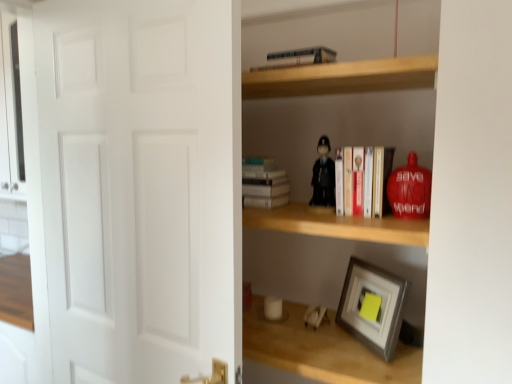
What do you see at coordinates (362, 181) in the screenshot?
I see `hardcover books at center, positioned as the first book in right-to-left order` at bounding box center [362, 181].

Image resolution: width=512 pixels, height=384 pixels. Find the location of `white matte door at left`. white matte door at left is located at coordinates (141, 186).

You are a GUI agent. You are given a task and a screenshot of the screen. Output one action in this format:
    pyautogui.click(x=<x>, y=<y>)
    Task: Click on the wooden shelf at lower right, positioned as the 1th shelf in bottom-to-top order
    The image size is (512, 384).
    Given the screenshot: What is the action you would take?
    pyautogui.click(x=325, y=267)

Identify the location of the 3rd toy directly beneath the wooden shelf at upper center (from a real-world perspective). (315, 316).

Can you confirm if white plastic toy at lower center, the first toy when ordered from back to front, is wider than wooden shelf at upper center?

No, white plastic toy at lower center, the first toy when ordered from back to front, is not wider than wooden shelf at upper center.

Considering the positions of objects white plastic toy at lower center, arranged as the 3th toy when viewed from the top, and wooden shelf at upper center in the image provided, who is more to the right, white plastic toy at lower center, arranged as the 3th toy when viewed from the top, or wooden shelf at upper center?

Positioned to the right is white plastic toy at lower center, arranged as the 3th toy when viewed from the top.

From a real-world perspective, is white plastic toy at lower center, arranged as the 3th toy when viewed from the top, above or below wooden shelf at upper center?

white plastic toy at lower center, arranged as the 3th toy when viewed from the top, is situated lower than wooden shelf at upper center in the real world.

Can we say metallic silver train at upper center, acting as the 2th book starting from the right, lies outside hardcover books at center, the second book in the left-to-right sequence?

Yes, metallic silver train at upper center, acting as the 2th book starting from the right, is located beyond the bounds of hardcover books at center, the second book in the left-to-right sequence.

Could you tell me if metallic silver train at upper center, the first book when ordered from left to right, is turned towards hardcover books at center, arranged as the first book when ordered from the bottom?

No, metallic silver train at upper center, the first book when ordered from left to right, is not aimed at hardcover books at center, arranged as the first book when ordered from the bottom.

From their relative heights in the image, would you say metallic silver train at upper center, the 1th book positioned from the top, is taller or shorter than hardcover books at center, the second book in the left-to-right sequence?

Considering their sizes, metallic silver train at upper center, the 1th book positioned from the top, has less height than hardcover books at center, the second book in the left-to-right sequence.

Does point (254, 68) appear closer or farther from the camera than point (356, 201)?

Point (254, 68) is positioned farther from the camera compared to point (356, 201).

Is matte black figurine at center, which is the 2th toy in left-to-right order, taller than wooden shelf at upper center?

Yes, matte black figurine at center, which is the 2th toy in left-to-right order, is taller than wooden shelf at upper center.

Can you confirm if matte black figurine at center, marked as the 2th toy in a front-to-back arrangement, is bigger than wooden shelf at upper center?

Actually, matte black figurine at center, marked as the 2th toy in a front-to-back arrangement, might be smaller than wooden shelf at upper center.

Would you say wooden shelf at upper center is part of matte black figurine at center, which appears as the 3th toy when ordered from the bottom,'s contents?

Actually, wooden shelf at upper center is outside matte black figurine at center, which appears as the 3th toy when ordered from the bottom.

How distant is metallic silver train at upper center, marked as the second book in a bottom-to-top arrangement, from wooden shelf at lower right, positioned as the 1th shelf in bottom-to-top order?

metallic silver train at upper center, marked as the second book in a bottom-to-top arrangement, is 30.89 inches away from wooden shelf at lower right, positioned as the 1th shelf in bottom-to-top order.

From a real-world perspective, is metallic silver train at upper center, marked as the second book in a bottom-to-top arrangement, over wooden shelf at lower right, positioned as the 1th shelf in bottom-to-top order?

Yes, from a real-world perspective, metallic silver train at upper center, marked as the second book in a bottom-to-top arrangement, is on top of wooden shelf at lower right, positioned as the 1th shelf in bottom-to-top order.

Between metallic silver train at upper center, marked as the second book in a bottom-to-top arrangement, and wooden shelf at lower right, the second shelf from the top, which one has less height?

Standing shorter between the two is wooden shelf at lower right, the second shelf from the top.

Based on the photo, is metallic silver train at upper center, the first book when ordered from left to right, not inside wooden shelf at lower right, positioned as the 1th shelf in bottom-to-top order?

metallic silver train at upper center, the first book when ordered from left to right, is positioned outside wooden shelf at lower right, positioned as the 1th shelf in bottom-to-top order.

Which is in front, matte red vase at upper right, the 3th toy in the left-to-right sequence, or wooden shelf at upper center?

→ Positioned in front is wooden shelf at upper center.

Could you tell me if matte red vase at upper right, positioned as the second toy in bottom-to-top order, is facing wooden shelf at upper center?

No, matte red vase at upper right, positioned as the second toy in bottom-to-top order, is not turned towards wooden shelf at upper center.

Which object is positioned more to the right, matte red vase at upper right, the 3th toy in the left-to-right sequence, or wooden shelf at upper center?

Positioned to the right is matte red vase at upper right, the 3th toy in the left-to-right sequence.

Is the surface of matte red vase at upper right, which is counted as the first toy, starting from the right, in direct contact with wooden shelf at upper center?

matte red vase at upper right, which is counted as the first toy, starting from the right, and wooden shelf at upper center are not in contact.

Considering the relative sizes of wooden shelf at center, the second shelf when ordered from bottom to top, and matte red vase at upper right, which is counted as the first toy, starting from the right, in the image provided, is wooden shelf at center, the second shelf when ordered from bottom to top, shorter than matte red vase at upper right, which is counted as the first toy, starting from the right,?

Incorrect, the height of wooden shelf at center, the second shelf when ordered from bottom to top, does not fall short of that of matte red vase at upper right, which is counted as the first toy, starting from the right.

Between wooden shelf at center, the second shelf when ordered from bottom to top, and matte red vase at upper right, the 3th toy in the left-to-right sequence, which one has smaller width?

matte red vase at upper right, the 3th toy in the left-to-right sequence.

Is wooden shelf at center, the first shelf when ordered from top to bottom, positioned before matte red vase at upper right, arranged as the 2th toy when viewed from the top?

Yes, wooden shelf at center, the first shelf when ordered from top to bottom, is closer to the viewer.

Which is more to the right, wooden shelf at center, the first shelf when ordered from top to bottom, or matte red vase at upper right, placed as the 3th toy when sorted from back to front?

Positioned to the right is matte red vase at upper right, placed as the 3th toy when sorted from back to front.

Is white plastic toy at lower center, acting as the third toy starting from the front, turned away from matte red vase at upper right, the 3th toy in the left-to-right sequence?

No, white plastic toy at lower center, acting as the third toy starting from the front, is not facing the opposite direction of matte red vase at upper right, the 3th toy in the left-to-right sequence.

Is the depth of white plastic toy at lower center, acting as the third toy starting from the front, less than that of matte red vase at upper right, positioned as the second toy in bottom-to-top order?

No, it is behind matte red vase at upper right, positioned as the second toy in bottom-to-top order.

From the image's perspective, is white plastic toy at lower center, the first toy positioned from the bottom, on matte red vase at upper right, positioned as the second toy in bottom-to-top order?

No, from the image's perspective, white plastic toy at lower center, the first toy positioned from the bottom, is not over matte red vase at upper right, positioned as the second toy in bottom-to-top order.

Is white plastic toy at lower center, arranged as the 3th toy when viewed from the right, next to matte red vase at upper right, the 3th toy in the left-to-right sequence?

They are not placed beside each other.

The image size is (512, 384). Identify the location of the 3rd toy behind the wooden shelf at upper center, starting your count from the anchor. (315, 316).

Locate an element on the screen. This screenshot has width=512, height=384. book located on the left of hardcover books at center, arranged as the first book when ordered from the bottom is located at coordinates (298, 58).

Considering their positions, is white matte door at left positioned further to matte black figurine at center, which appears as the 3th toy when ordered from the bottom, than wooden shelf at center, the first shelf when ordered from top to bottom?

white matte door at left lies further to matte black figurine at center, which appears as the 3th toy when ordered from the bottom, than the other object.

From the picture: Estimate the real-world distances between objects in this image. Which object is further from wooden shelf at lower right, positioned as the 1th shelf in bottom-to-top order, white matte door at left or metallic silver train at upper center, the 1th book positioned from the top?

The object further to wooden shelf at lower right, positioned as the 1th shelf in bottom-to-top order, is metallic silver train at upper center, the 1th book positioned from the top.

Based on their spatial positions, is metallic silver train at upper center, acting as the 2th book starting from the right, or wooden shelf at lower right, positioned as the 1th shelf in bottom-to-top order, closer to hardcover books at center, the second book in the left-to-right sequence?

Among the two, metallic silver train at upper center, acting as the 2th book starting from the right, is located nearer to hardcover books at center, the second book in the left-to-right sequence.

Estimate the real-world distances between objects in this image. Which object is closer to white matte stack of books at upper center, white matte door at left or matte black figurine at center, placed as the second toy when sorted from back to front?

Among the two, matte black figurine at center, placed as the second toy when sorted from back to front, is located nearer to white matte stack of books at upper center.

Based on the photo, when comparing their distances from metallic silver train at upper center, the 1th book positioned from the top, does hardcover books at center, positioned as the first book in right-to-left order, or white matte door at left seem further?

white matte door at left.

When comparing their distances from metallic silver train at upper center, the 1th book positioned from the top, does white plastic toy at lower center, acting as the third toy starting from the front, or matte black figurine at center, which is the 2th toy in left-to-right order, seem closer?

matte black figurine at center, which is the 2th toy in left-to-right order, is closer to metallic silver train at upper center, the 1th book positioned from the top.

Which object lies further to the anchor point white matte door at left, wooden shelf at center, the second shelf when ordered from bottom to top, or white matte stack of books at upper center?

The object further to white matte door at left is wooden shelf at center, the second shelf when ordered from bottom to top.

Based on their spatial positions, is white matte stack of books at upper center or matte black figurine at center, marked as the 2th toy in a front-to-back arrangement, closer to wooden shelf at center, the second shelf when ordered from bottom to top?

Based on the image, white matte stack of books at upper center appears to be nearer to wooden shelf at center, the second shelf when ordered from bottom to top.

Where is `cabinet located between white matte stack of books at upper center and matte red vase at upper right, placed as the 3th toy when sorted from back to front, in the left-right direction`? This screenshot has width=512, height=384. cabinet located between white matte stack of books at upper center and matte red vase at upper right, placed as the 3th toy when sorted from back to front, in the left-right direction is located at coordinates (342, 77).

The height and width of the screenshot is (384, 512). Find the location of `paperback book between metallic silver train at upper center, the 1th book positioned from the top, and wooden shelf at lower right, positioned as the 1th shelf in bottom-to-top order, in the up-down direction`. paperback book between metallic silver train at upper center, the 1th book positioned from the top, and wooden shelf at lower right, positioned as the 1th shelf in bottom-to-top order, in the up-down direction is located at coordinates (263, 183).

Where is `paperback book between wooden shelf at upper center and wooden shelf at lower right, positioned as the 1th shelf in bottom-to-top order, vertically`? This screenshot has height=384, width=512. paperback book between wooden shelf at upper center and wooden shelf at lower right, positioned as the 1th shelf in bottom-to-top order, vertically is located at coordinates (263, 183).

Find the location of a particular element. This screenshot has height=384, width=512. cabinet located between white matte door at left and hardcover books at center, acting as the second book starting from the top, in the left-right direction is located at coordinates (342, 77).